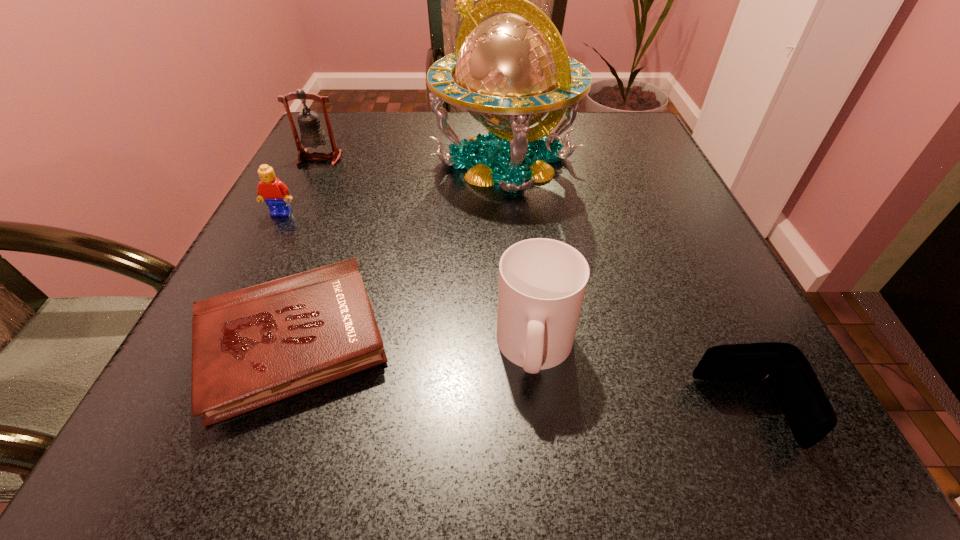
Image resolution: width=960 pixels, height=540 pixels. Find the location of `vacant space situated on the handle side of the mug`. vacant space situated on the handle side of the mug is located at coordinates (544, 430).

The width and height of the screenshot is (960, 540). Find the location of `vacant region located on the front-facing side of the Lego`. vacant region located on the front-facing side of the Lego is located at coordinates (230, 313).

Identify the location of vacant area located on the outer surface of the fifth tallest object. (663, 412).

Image resolution: width=960 pixels, height=540 pixels. Find the location of `vacant area situated on the outer surface of the fifth tallest object`. vacant area situated on the outer surface of the fifth tallest object is located at coordinates (438, 412).

Locate an element on the screen. The width and height of the screenshot is (960, 540). free space located on the outer surface of the fifth tallest object is located at coordinates (663, 412).

Identify the location of vacant space located 0.120m on the back of the shortest object. The height and width of the screenshot is (540, 960). (333, 234).

The image size is (960, 540). Identify the location of globe that is at the far edge. (512, 69).

In order to click on bell located in the far edge section of the desktop in this screenshot , I will do `click(312, 134)`.

The width and height of the screenshot is (960, 540). In order to click on wallet situated at the near edge in this screenshot , I will do pos(810,415).

Locate an element on the screen. This screenshot has height=540, width=960. hardback book at the near edge is located at coordinates (251, 347).